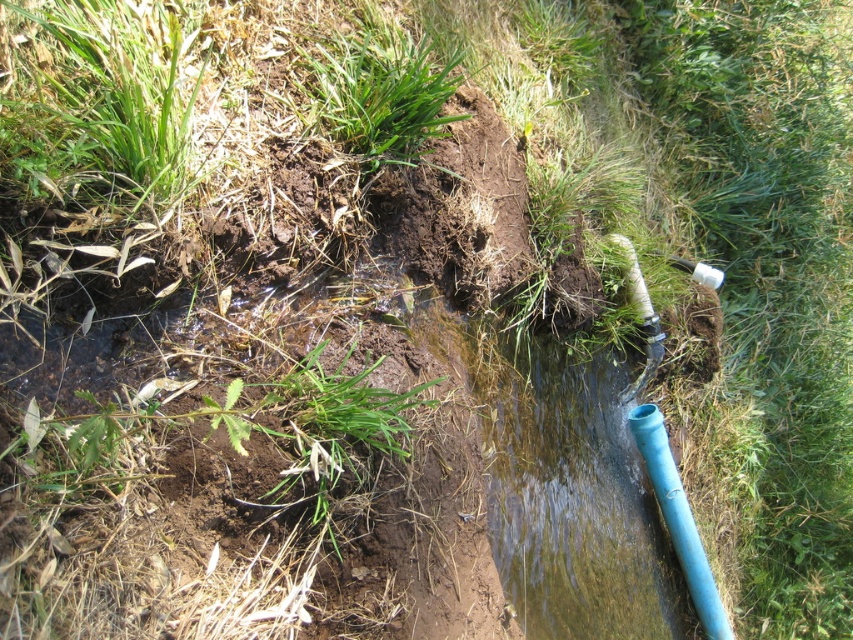
In the scene shown: You are a landscape architect inspecting the trench. You notice the green grass at center and the blue plastic pipe at lower right. Which object has a smaller width?

The green grass at center has a smaller width than the blue plastic pipe at lower right according to the description.

You are a landscaper who needs to connect the white textured hose at center right to a water source located near the green grass at center. Given that the hose is 4 feet long, will it reach the water source without needing to be moved?

The green grass at center is 4.66 feet away from the white textured hose at center right. Since the hose is only 4 feet long, it will not reach the water source without being moved closer.